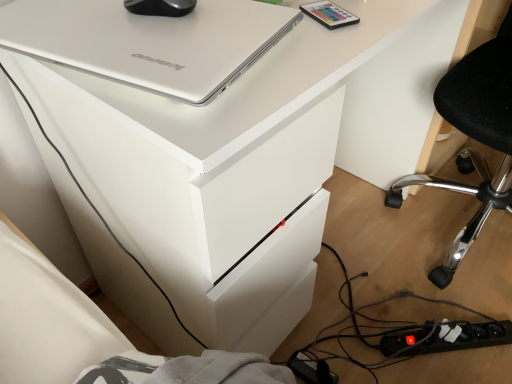
The height and width of the screenshot is (384, 512). What are the coordinates of `blank space to the left of black rubberized mouse at upper center` in the screenshot? It's located at 68,13.